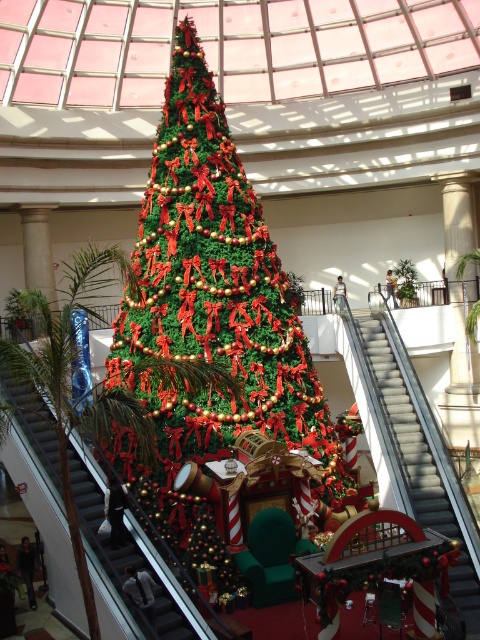
Can you confirm if green artificial christmas tree at center is bigger than metallic silver escalator at left?

Correct, green artificial christmas tree at center is larger in size than metallic silver escalator at left.

Can you confirm if green artificial christmas tree at center is positioned to the left of metallic silver escalator at left?

No, green artificial christmas tree at center is not to the left of metallic silver escalator at left.

What do you see at coordinates (211, 317) in the screenshot? This screenshot has height=640, width=480. I see `green artificial christmas tree at center` at bounding box center [211, 317].

The height and width of the screenshot is (640, 480). What are the coordinates of `green artificial christmas tree at center` in the screenshot? It's located at (211, 317).

Between point (412, 401) and point (81, 442), which one is positioned behind?

The point (412, 401) is behind.

Can you confirm if metallic gray escalator at center is taller than metallic silver escalator at left?

Correct, metallic gray escalator at center is much taller as metallic silver escalator at left.

Which is in front, point (372, 452) or point (43, 451)?

Positioned in front is point (43, 451).

Where is `metallic gray escalator at center`? This screenshot has height=640, width=480. metallic gray escalator at center is located at coordinates click(408, 444).

What do you see at coordinates (211, 317) in the screenshot? This screenshot has height=640, width=480. I see `green artificial christmas tree at center` at bounding box center [211, 317].

Can you confirm if green artificial christmas tree at center is positioned to the right of metallic gray escalator at center?

In fact, green artificial christmas tree at center is to the left of metallic gray escalator at center.

Who is more forward, (x=218, y=124) or (x=373, y=392)?

Point (x=218, y=124) is in front.

Where is `green artificial christmas tree at center`? green artificial christmas tree at center is located at coordinates (211, 317).